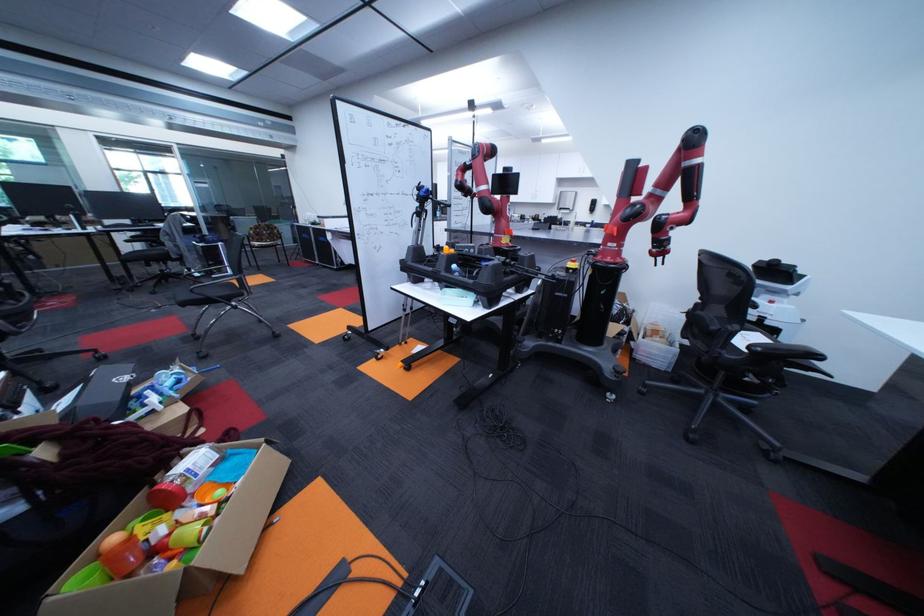
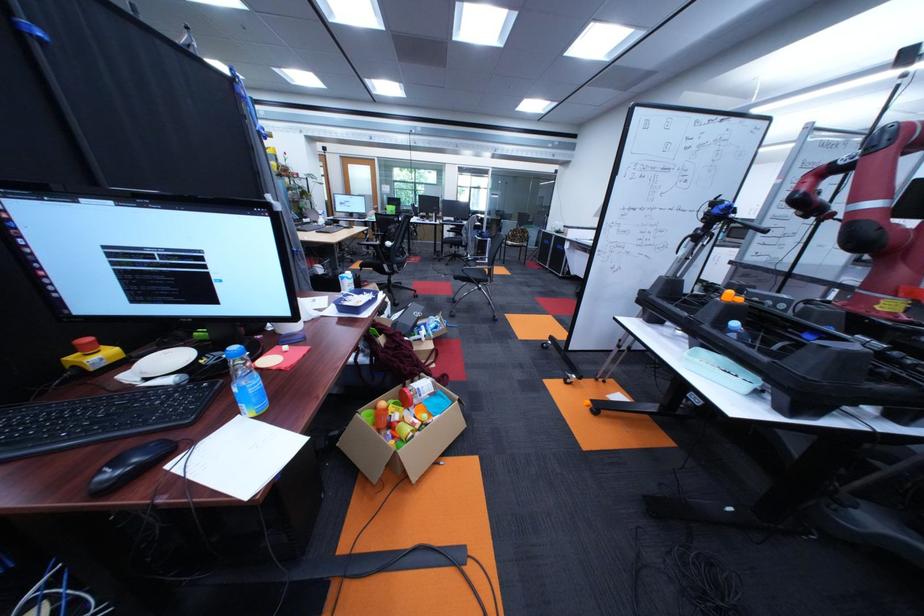
Question: The camera is either moving clockwise (left) or counter-clockwise (right) around the object. The first image is from the beginning of the video and the second image is from the end. Is the camera moving left or right when shooting the video?

Choices:
 (A) Left
 (B) Right

Answer: (B)